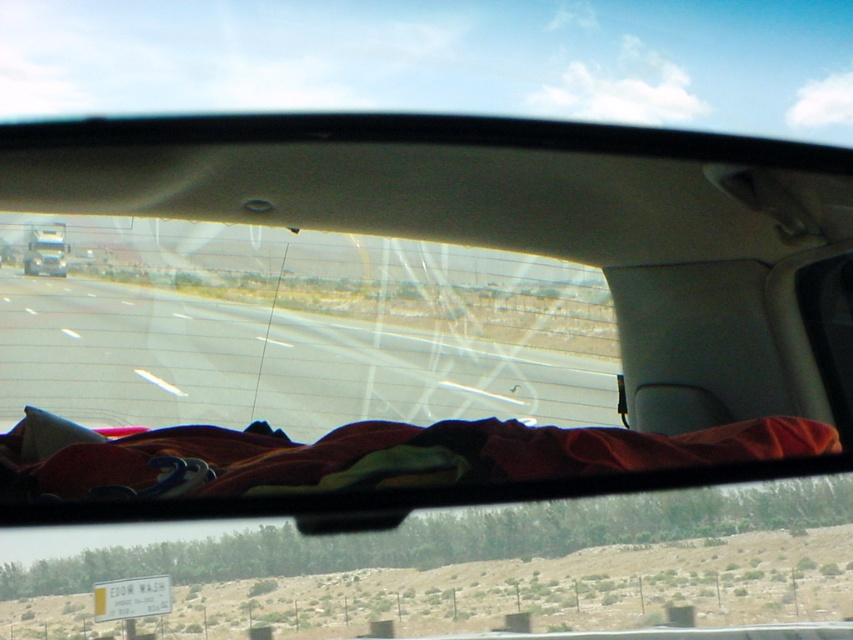
Looking at this image, you are a passenger in the car and want to see the metallic silver truck at left through the transparent glass car window at center. Can you see the entire truck through the window?

The transparent glass car window at center has a greater height compared to metallic silver truck at left, so yes, you can see the entire metallic silver truck at left through the transparent glass car window at center since the window is taller than the truck.

You are driving and want to check the metallic silver truck at left in the rearview mirror. Can you see it through the transparent glass car window at center?

The transparent glass car window at center is below the metallic silver truck at left, so the truck is positioned higher than the window. This means the metallic silver truck at left would be visible above the transparent glass car window at center in the driver view.

You are driving a car and want to check if there is enough space to safely pass the metallic silver truck at left. Since you can see the transparent glass car window at center in your view, can you determine if the truck is directly in front of you or further back?

The transparent glass car window at center is in front of the metallic silver truck at left, meaning the truck is further back and not directly blocking your path. You can safely pass if there is enough space.